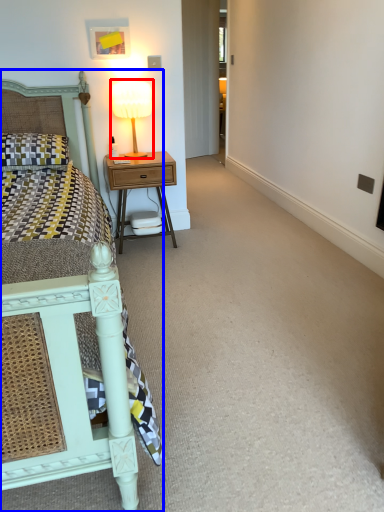
Question: Which point is further to the camera, bedside lamp (highlighted by a red box) or bed (highlighted by a blue box)?

Choices:
 (A) bedside lamp
 (B) bed

Answer: (A)